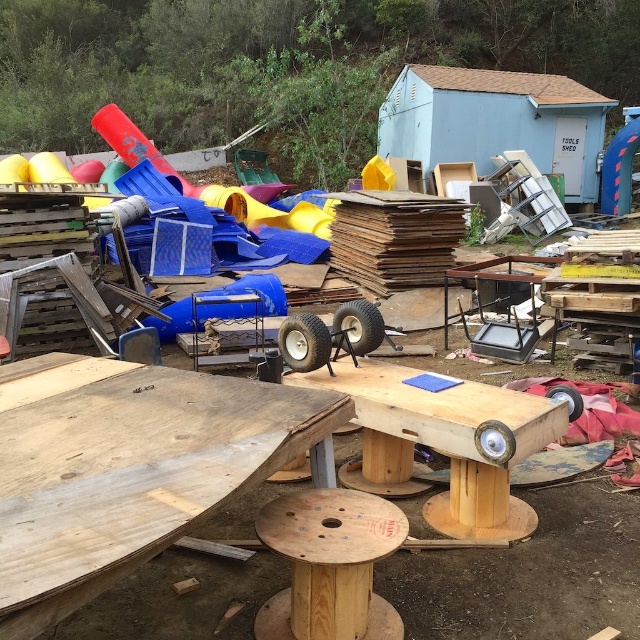
You are a worker trying to move a large box that requires a surface larger than the wooden plank at center. Is the brown cardboard at center a suitable replacement?

The wooden plank at center is smaller than brown cardboard at center, so the brown cardboard at center is larger and can be used as a suitable replacement.

You are organizing a small outdoor event and need to set up a table and a shed. The wooden spool table at center and the blue painted wood shed at upper center are available. Which one should you place first if you want to ensure visibility from the entrance?

The wooden spool table at center is shorter than the blue painted wood shed at upper center. Therefore, you should place the wooden spool table at center first to ensure the taller shed doesn t block the view of the table from the entrance.

You are organizing a small outdoor event and need to set up a table and a shed. You have the wooden spool table at center and the blue painted wood shed at upper center. Which one should you choose if you want the larger structure for shelter?

The blue painted wood shed at upper center is larger in size compared to the wooden spool table at center, so it would be the better choice for shelter.